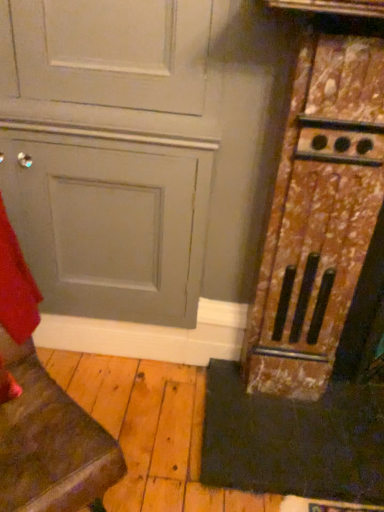
This screenshot has height=512, width=384. Find the location of `matte gray door at center`. matte gray door at center is located at coordinates (109, 221).

Where is `matte gray door at lower left`? The width and height of the screenshot is (384, 512). matte gray door at lower left is located at coordinates (42, 410).

What is the approximate width of rusty wood stove at right?

It is 16.23 inches.

I want to click on rusty wood stove at right, so click(318, 215).

Where is `matte gray door at center`? This screenshot has height=512, width=384. matte gray door at center is located at coordinates (109, 221).

Considering the relative sizes of matte gray door at center and matte gray door at lower left in the image provided, is matte gray door at center shorter than matte gray door at lower left?

No.

Are matte gray door at center and matte gray door at lower left making contact?

No, matte gray door at center is not touching matte gray door at lower left.

Would you say matte gray door at center is outside matte gray door at lower left?

Absolutely, matte gray door at center is external to matte gray door at lower left.

At what (x,y) coordinates should I click in order to perform the action: click on doormat on the right side of matte gray door at center. Please return your answer as a coordinate pair (x, y). The image size is (384, 512). Looking at the image, I should click on (293, 440).

In terms of width, does matte gray door at center look wider or thinner when compared to black rubber doormat at lower right?

Clearly, matte gray door at center has less width compared to black rubber doormat at lower right.

From a real-world perspective, which object rests below the other?

black rubber doormat at lower right is physically lower.

Is matte gray door at center turned away from black rubber doormat at lower right?

No, matte gray door at center is not facing away from black rubber doormat at lower right.

Is black rubber doormat at lower right located outside matte gray door at lower left?

Absolutely, black rubber doormat at lower right is external to matte gray door at lower left.

Between black rubber doormat at lower right and matte gray door at lower left, which one appears on the right side from the viewer's perspective?

Positioned to the right is black rubber doormat at lower right.

Which is behind, point (231, 382) or point (3, 236)?

The point (231, 382) is more distant.

From the image's perspective, which object appears higher, rusty wood stove at right or matte gray door at lower left?

rusty wood stove at right is shown above in the image.

Is rusty wood stove at right facing away from matte gray door at lower left?

No, rusty wood stove at right is not facing the opposite direction of matte gray door at lower left.

Does rusty wood stove at right appear on the right side of matte gray door at lower left?

Indeed, rusty wood stove at right is positioned on the right side of matte gray door at lower left.

In the scene shown: Which of these two, rusty wood stove at right or matte gray door at lower left, stands shorter?

matte gray door at lower left.

From a real-world perspective, is black rubber doormat at lower right physically located above or below rusty wood stove at right?

Clearly, from a real-world perspective, black rubber doormat at lower right is below rusty wood stove at right.

From the image's perspective, relative to rusty wood stove at right, is black rubber doormat at lower right above or below?

black rubber doormat at lower right is situated lower than rusty wood stove at right in the image.

Considering the points (306, 482) and (289, 371), which point is behind, point (306, 482) or point (289, 371)?

The point (289, 371) is behind.

Is black rubber doormat at lower right in front of rusty wood stove at right?

That is False.

Locate an element on the screen. doormat behind the rusty wood stove at right is located at coordinates (293, 440).

Considering the relative sizes of rusty wood stove at right and black rubber doormat at lower right in the image provided, is rusty wood stove at right shorter than black rubber doormat at lower right?

In fact, rusty wood stove at right may be taller than black rubber doormat at lower right.

Between point (336, 196) and point (316, 467), which one is positioned behind?

The point (316, 467) is more distant.

Is rusty wood stove at right oriented towards black rubber doormat at lower right?

Yes.

Is matte gray door at lower left aimed at rusty wood stove at right?

No, matte gray door at lower left does not turn towards rusty wood stove at right.

From a real-world perspective, is matte gray door at lower left positioned under rusty wood stove at right based on gravity?

Indeed, from a real-world perspective, matte gray door at lower left is positioned beneath rusty wood stove at right.

Can you confirm if matte gray door at lower left is taller than rusty wood stove at right?

No, matte gray door at lower left is not taller than rusty wood stove at right.

Is matte gray door at lower left positioned behind rusty wood stove at right?

No, it is in front of rusty wood stove at right.

Identify the location of door on the right of the matte gray door at lower left. (109, 221).

Image resolution: width=384 pixels, height=512 pixels. In order to click on doormat that appears below the matte gray door at center (from a real-world perspective) in this screenshot , I will do `click(293, 440)`.

When comparing their distances from matte gray door at center, does black rubber doormat at lower right or rusty wood stove at right seem further?

black rubber doormat at lower right is positioned further to the anchor matte gray door at center.

Looking at the image, which one is located closer to black rubber doormat at lower right, matte gray door at center or matte gray door at lower left?

Among the two, matte gray door at center is located nearer to black rubber doormat at lower right.

Based on their spatial positions, is matte gray door at lower left or black rubber doormat at lower right closer to rusty wood stove at right?

Among the two, black rubber doormat at lower right is located nearer to rusty wood stove at right.

From the picture: Which object lies further to the anchor point black rubber doormat at lower right, matte gray door at lower left or matte gray door at center?

matte gray door at lower left.

Which object lies further to the anchor point black rubber doormat at lower right, matte gray door at lower left or rusty wood stove at right?

The object further to black rubber doormat at lower right is matte gray door at lower left.

Looking at the image, which one is located closer to matte gray door at lower left, black rubber doormat at lower right or matte gray door at center?

The object closer to matte gray door at lower left is matte gray door at center.

From the image, which object appears to be farther from matte gray door at center, matte gray door at lower left or rusty wood stove at right?

Based on the image, rusty wood stove at right appears to be further to matte gray door at center.

Which object lies further to the anchor point rusty wood stove at right, matte gray door at center or black rubber doormat at lower right?

Among the two, matte gray door at center is located further to rusty wood stove at right.

Where is `doormat between matte gray door at center and rusty wood stove at right`? doormat between matte gray door at center and rusty wood stove at right is located at coordinates (293, 440).

Identify the location of door located between matte gray door at lower left and black rubber doormat at lower right in the left-right direction. The height and width of the screenshot is (512, 384). (109, 221).

At what (x,y) coordinates should I click in order to perform the action: click on doormat between matte gray door at lower left and rusty wood stove at right. Please return your answer as a coordinate pair (x, y). Looking at the image, I should click on (293, 440).

At what (x,y) coordinates should I click in order to perform the action: click on door located between matte gray door at lower left and rusty wood stove at right in the left-right direction. Please return your answer as a coordinate pair (x, y). This screenshot has height=512, width=384. Looking at the image, I should click on (109, 221).